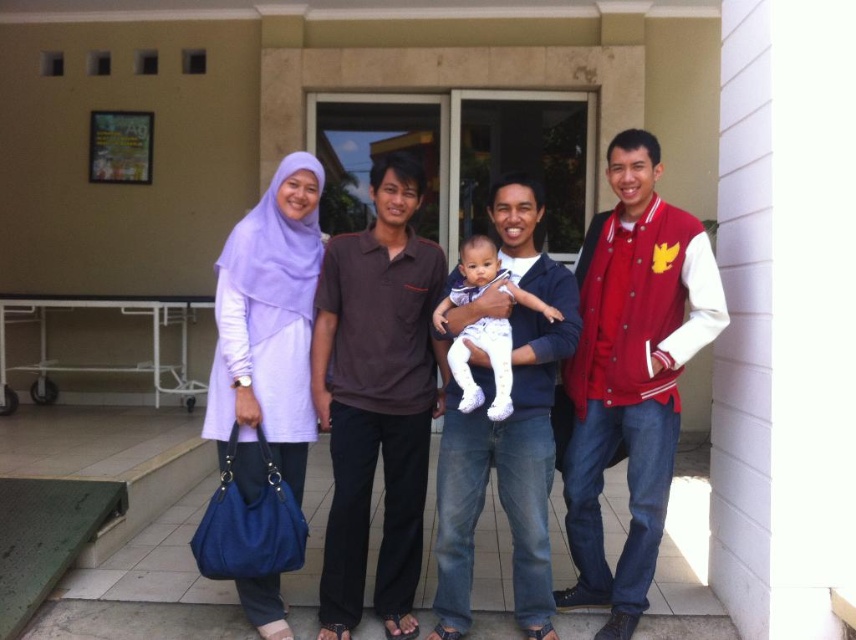
Question: Among these points, which one is nearest to the camera?

Choices:
 (A) (608, 392)
 (B) (521, 300)

Answer: (B)

Question: Considering the relative positions of matte purple hijab at upper left and white soft baby at center in the image provided, where is matte purple hijab at upper left located with respect to white soft baby at center?

Choices:
 (A) below
 (B) above

Answer: (A)

Question: Observing the image, what is the correct spatial positioning of matte purple hijab at upper left in reference to white soft baby at center?

Choices:
 (A) below
 (B) above

Answer: (A)

Question: Is matte purple hijab at upper left smaller than white soft baby at center?

Choices:
 (A) yes
 (B) no

Answer: (B)